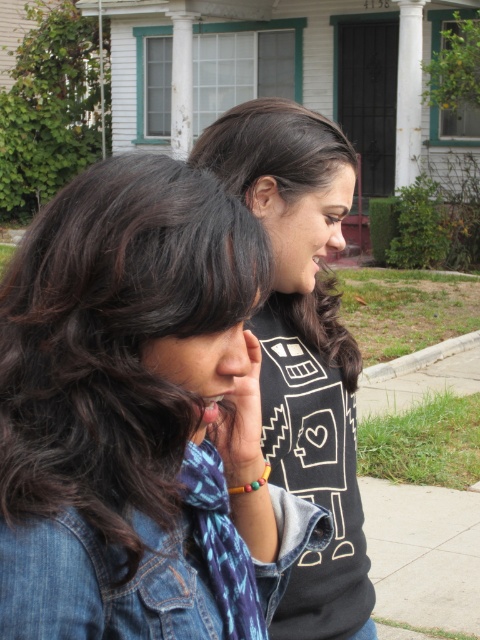
Which is below, black matte sweatshirt at center or matte black hand at center?

matte black hand at center

This screenshot has height=640, width=480. What do you see at coordinates (302, 346) in the screenshot? I see `black matte sweatshirt at center` at bounding box center [302, 346].

Is point (288, 168) behind point (252, 355)?

Yes, point (288, 168) is farther from viewer.

Find the location of a particular element. This screenshot has height=640, width=480. black matte sweatshirt at center is located at coordinates (302, 346).

Between point (168, 548) and point (217, 499), which one is positioned in front?

Positioned in front is point (168, 548).

Can you confirm if denim jacket at center is bigger than denim jacket at lower right?

Yes.

Identify the location of denim jacket at center. (140, 417).

The height and width of the screenshot is (640, 480). In order to click on denim jacket at center in this screenshot , I will do `click(140, 417)`.

Between point (184, 508) and point (252, 355), which one is positioned in front?

Point (184, 508) is more forward.

Which is more to the right, denim jacket at lower right or matte black hand at center?

From the viewer's perspective, matte black hand at center appears more on the right side.

Does point (326, 512) lie in front of point (253, 451)?

No, (326, 512) is behind (253, 451).

You are a GUI agent. You are given a task and a screenshot of the screen. Output one action in this format:
    pyautogui.click(x=<x>, y=<y>)
    Task: Click on the denim jacket at lower right
    This screenshot has width=480, height=640.
    Given the screenshot: What is the action you would take?
    pyautogui.click(x=154, y=570)